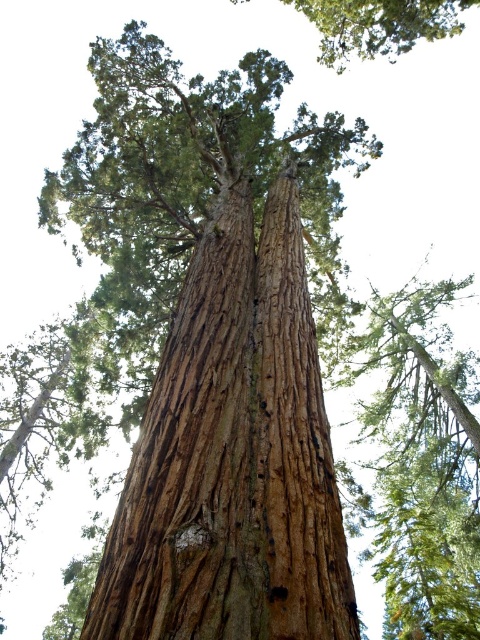
Question: Is brown rough bark tree at center smaller than brown rough bark tree at upper center?

Choices:
 (A) yes
 (B) no

Answer: (A)

Question: From the image, what is the correct spatial relationship of brown rough bark tree at center in relation to brown rough bark tree at upper center?

Choices:
 (A) below
 (B) above

Answer: (A)

Question: Which point is closer to the camera?

Choices:
 (A) brown rough bark tree at upper center
 (B) brown rough bark tree at center

Answer: (B)

Question: Which object appears closest to the camera in this image?

Choices:
 (A) brown rough bark tree at upper center
 (B) brown rough bark tree at center

Answer: (B)

Question: Is brown rough bark tree at center to the left of brown rough bark tree at upper center from the viewer's perspective?

Choices:
 (A) no
 (B) yes

Answer: (B)

Question: Which point appears closest to the camera in this image?

Choices:
 (A) (336, 45)
 (B) (287, 628)

Answer: (B)